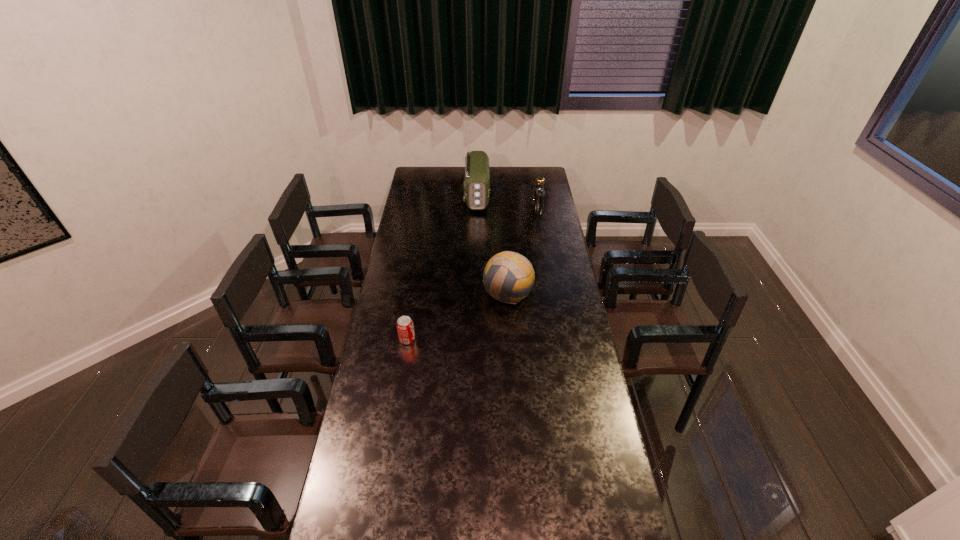
I want to click on radio_receiver, so coord(477,177).

Identify the location of the third farthest object. (508, 277).

Identify the location of vodka. The image size is (960, 540). (539, 193).

You are a GUI agent. You are given a task and a screenshot of the screen. Output one action in this format:
    pyautogui.click(x=<x>, y=<y>)
    Task: Click on the nearest object
    
    Given the screenshot: What is the action you would take?
    pyautogui.click(x=405, y=328)

Find the location of a particular element. The image size is (960, 540). the leftmost object is located at coordinates (405, 328).

Locate an element on the screen. This screenshot has height=540, width=960. vacant space located on the front-facing side of the radio_receiver is located at coordinates (476, 221).

Image resolution: width=960 pixels, height=540 pixels. What are the coordinates of `free region located 0.180m on the right of the second nearest object` in the screenshot? It's located at (572, 293).

Locate an element on the screen. The width and height of the screenshot is (960, 540). vacant area situated 0.300m on the front-facing side of the vodka is located at coordinates (480, 211).

Find the location of a particular element. free space located 0.050m on the front-facing side of the vodka is located at coordinates (523, 211).

I want to click on vacant space positioned on the front-facing side of the vodka, so click(479, 211).